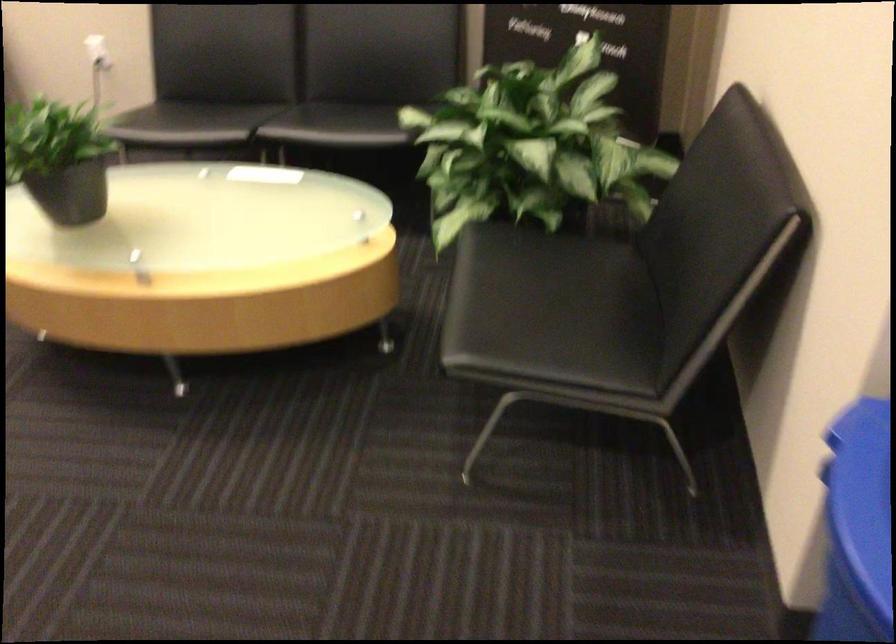
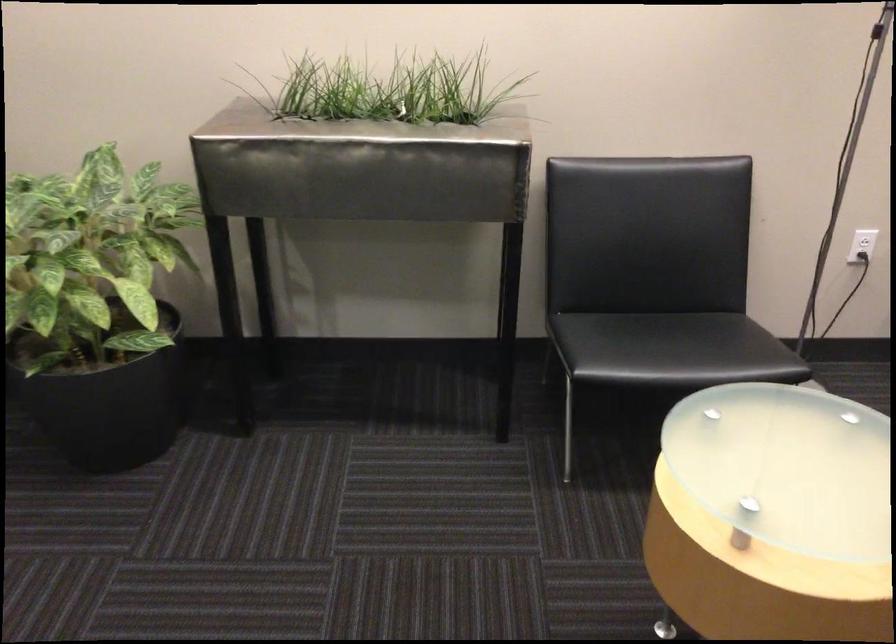
Question: Which direction would the cameraman need to move to produce the second image? Reply with the corresponding letter.

Choices:
 (A) Left
 (B) Right
 (C) Forward
 (D) Backward

Answer: (A)